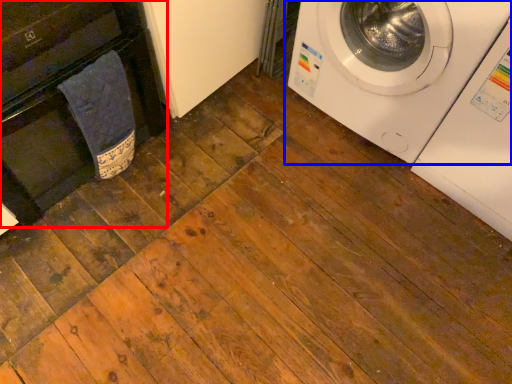
Question: Which object is closer to the camera taking this photo, dish washer (highlighted by a red box) or washing machine (highlighted by a blue box)?

Choices:
 (A) dish washer
 (B) washing machine

Answer: (A)